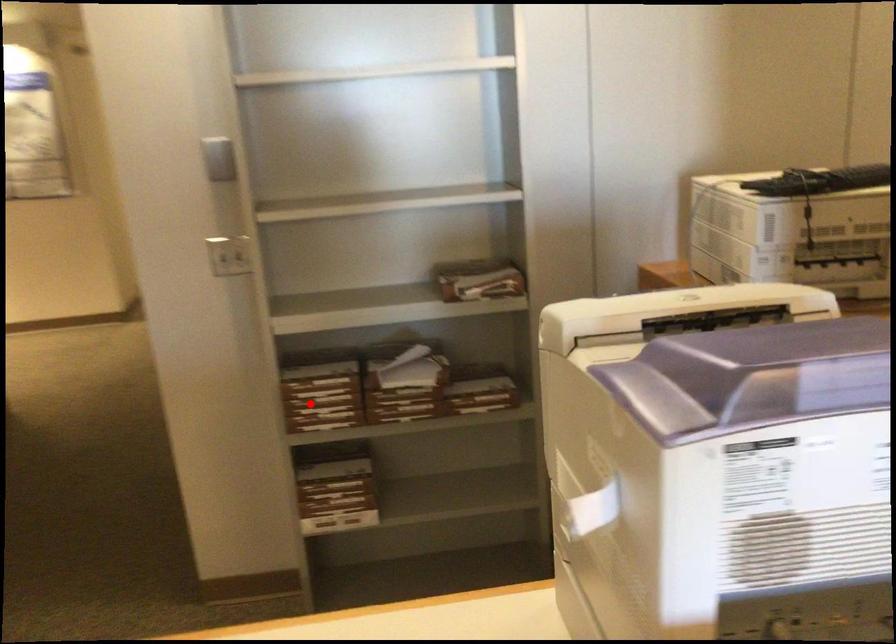
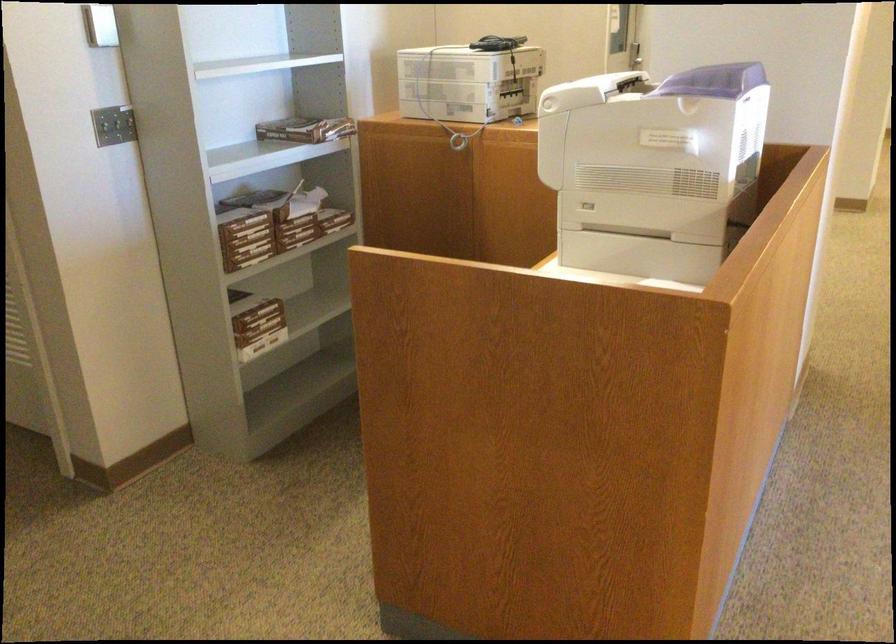
Question: I am providing you with two images of the same scene from different viewpoints. In image1, a red point is highlighted. Considering the same 3D point in image2, which of the following is correct?

Choices:
 (A) It is closer
 (B) It is farther

Answer: (B)